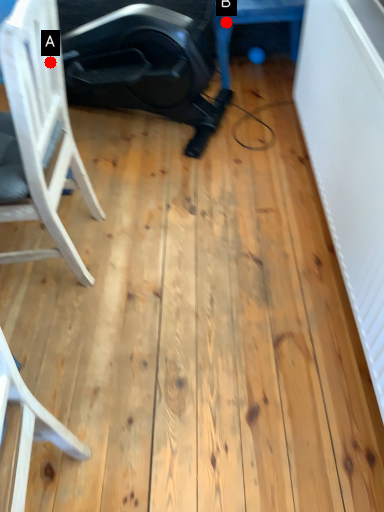
Question: Two points are circled on the image, labeled by A and B beside each circle. Which point is closer to the camera?

Choices:
 (A) A is closer
 (B) B is closer

Answer: (A)